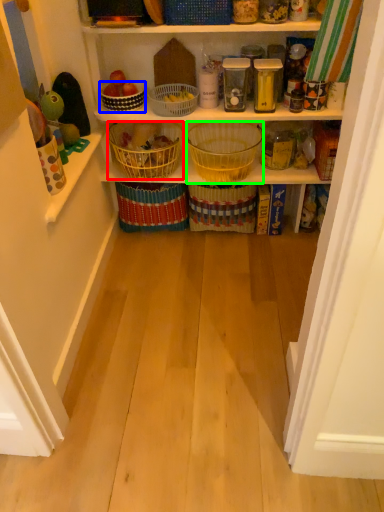
Question: Estimate the real-world distances between objects in this image. Which object is closer to basket (highlighted by a red box), basket (highlighted by a blue box) or basket (highlighted by a green box)?

Choices:
 (A) basket
 (B) basket

Answer: (A)